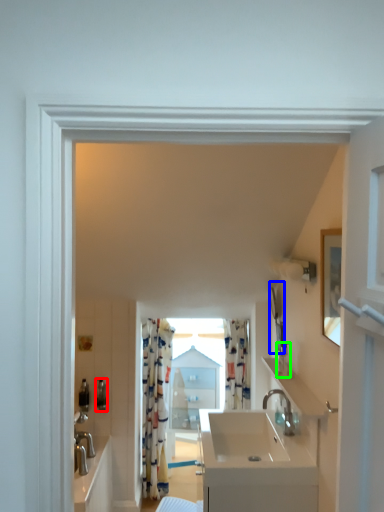
Question: Which is farther away from toiletry (highlighted by a red box)? mirror (highlighted by a blue box) or toiletry (highlighted by a green box)?

Choices:
 (A) mirror
 (B) toiletry

Answer: (B)